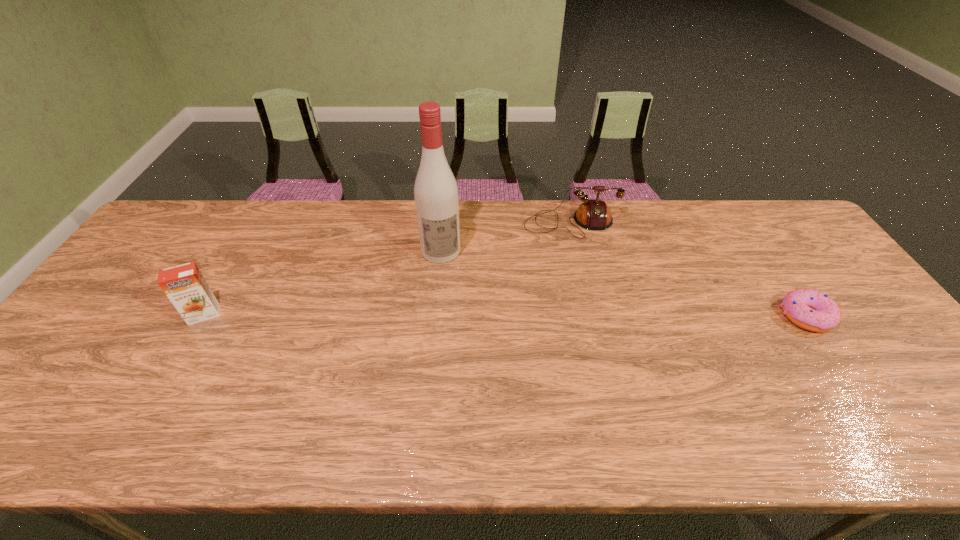
You are a GUI agent. You are given a task and a screenshot of the screen. Output one action in this format:
    pyautogui.click(x=<x>, y=<y>)
    Task: Click on the vacant space at the near edge
    Image resolution: width=960 pixels, height=540 pixels.
    Given the screenshot: What is the action you would take?
    855,404

Find the location of a particular element. The width and height of the screenshot is (960, 540). free spot at the right edge of the desktop is located at coordinates (828, 295).

What are the coordinates of `vacant space at the far left corner` in the screenshot? It's located at (155, 240).

This screenshot has width=960, height=540. In order to click on free region at the far right corner in this screenshot , I will do `click(748, 209)`.

Where is `vacant space that's between the second shortest object and the orange juice`? vacant space that's between the second shortest object and the orange juice is located at coordinates (388, 268).

Find the location of a particular element. The image size is (960, 540). vacant area that lies between the alcohol and the third tallest object is located at coordinates (506, 237).

At what (x,y) coordinates should I click in order to perform the action: click on free space between the third tallest object and the second tallest object. Please return your answer as a coordinate pair (x, y). This screenshot has height=540, width=960. Looking at the image, I should click on (388, 268).

At what (x,y) coordinates should I click in order to perform the action: click on vacant space in between the shortest object and the third object from left to right. Please return your answer as a coordinate pair (x, y). Looking at the image, I should click on (688, 269).

I want to click on vacant space in between the doughnut and the second object from left to right, so click(x=623, y=284).

This screenshot has height=540, width=960. Identify the location of free space between the shortest object and the leftmost object. (505, 315).